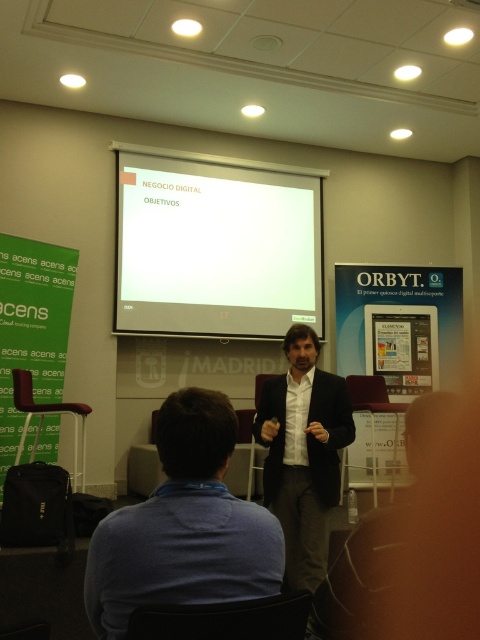
Where is `white matte projection screen at center`? This screenshot has height=640, width=480. white matte projection screen at center is located at coordinates (215, 246).

Is white matte projection screen at center bigger than blue cotton shirt at lower center?

Correct, white matte projection screen at center is larger in size than blue cotton shirt at lower center.

Which is in front, point (207, 232) or point (153, 502)?

Point (153, 502) is in front.

Find the location of a particular element. This screenshot has height=640, width=480. white matte projection screen at center is located at coordinates (215, 246).

Can you confirm if blue cotton shirt at lower center is shorter than green fabric banner at left?

Yes.

Who is more distant from viewer, (170,420) or (21,348)?

Point (21,348)

This screenshot has width=480, height=640. I want to click on blue cotton shirt at lower center, so click(183, 525).

Who is shorter, black matte suit at center or green fabric banner at left?

black matte suit at center

Between black matte suit at center and green fabric banner at left, which one appears on the right side from the viewer's perspective?

Positioned to the right is black matte suit at center.

Which is in front, point (287, 548) or point (48, 310)?

Point (287, 548) is in front.

Find the location of a particular element. black matte suit at center is located at coordinates (302, 452).